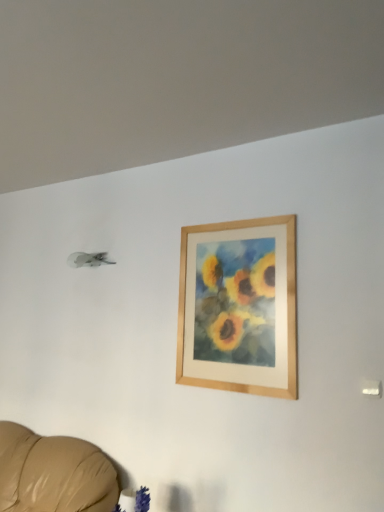
Question: Looking at their shapes, would you say velvety blue plant at lower center is wider or thinner than wooden frame at upper center?

Choices:
 (A) thin
 (B) wide

Answer: (B)

Question: Is point (137, 507) positioned closer to the camera than point (188, 283)?

Choices:
 (A) farther
 (B) closer

Answer: (B)

Question: Is velvety blue plant at lower center inside the boundaries of wooden frame at upper center, or outside?

Choices:
 (A) outside
 (B) inside

Answer: (A)

Question: In terms of width, does wooden frame at upper center look wider or thinner when compared to velvety blue plant at lower center?

Choices:
 (A) thin
 (B) wide

Answer: (A)

Question: Based on their positions, is wooden frame at upper center located to the left or right of velvety blue plant at lower center?

Choices:
 (A) left
 (B) right

Answer: (B)

Question: Considering their positions, is wooden frame at upper center located in front of or behind velvety blue plant at lower center?

Choices:
 (A) behind
 (B) front

Answer: (A)

Question: From their relative heights in the image, would you say wooden frame at upper center is taller or shorter than velvety blue plant at lower center?

Choices:
 (A) short
 (B) tall

Answer: (B)